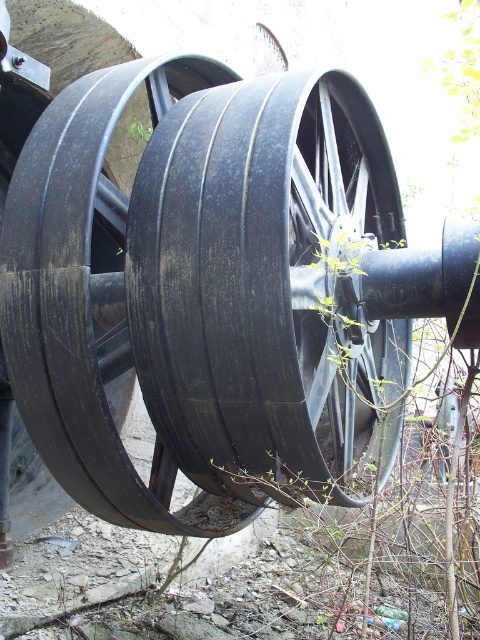
Is black rubber wheel at center further to the viewer compared to black rubber tire at center?

Yes, it is.

Can you confirm if black rubber wheel at center is positioned above black rubber tire at center?

No, black rubber wheel at center is not above black rubber tire at center.

This screenshot has width=480, height=640. Describe the element at coordinates (263, 282) in the screenshot. I see `black rubber wheel at center` at that location.

Find the location of a particular element. black rubber wheel at center is located at coordinates (263, 282).